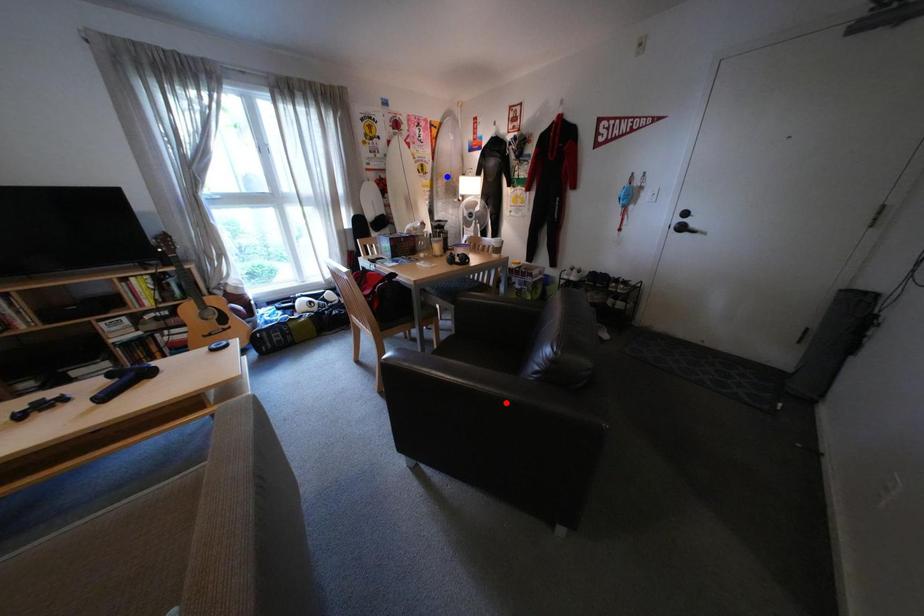
Question: Which of the two points in the image is closer to the camera?

Choices:
 (A) Blue point is closer.
 (B) Red point is closer.

Answer: (B)